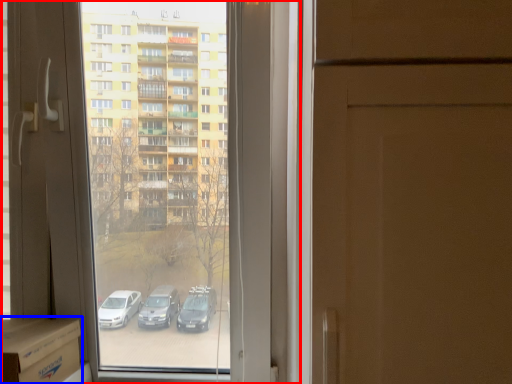
Question: Which object is further to the camera taking this photo, window (highlighted by a red box) or cardboard box (highlighted by a blue box)?

Choices:
 (A) window
 (B) cardboard box

Answer: (A)